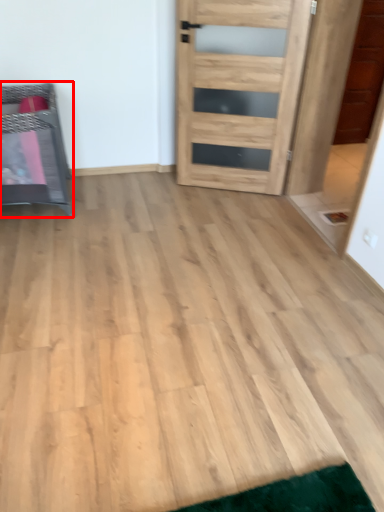
Question: Observing the image, what is the correct spatial positioning of furniture (annotated by the red box) in reference to door?

Choices:
 (A) right
 (B) left

Answer: (B)